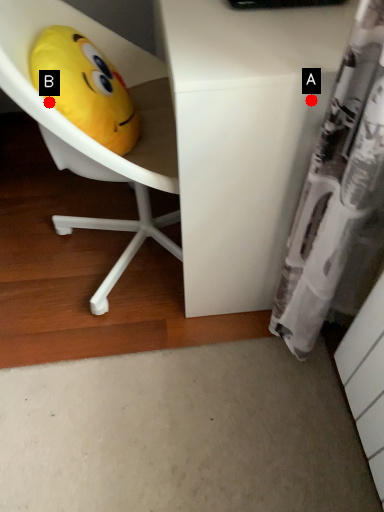
Question: Two points are circled on the image, labeled by A and B beside each circle. Which of the following is the farthest from the observer?

Choices:
 (A) A is further
 (B) B is further

Answer: (B)